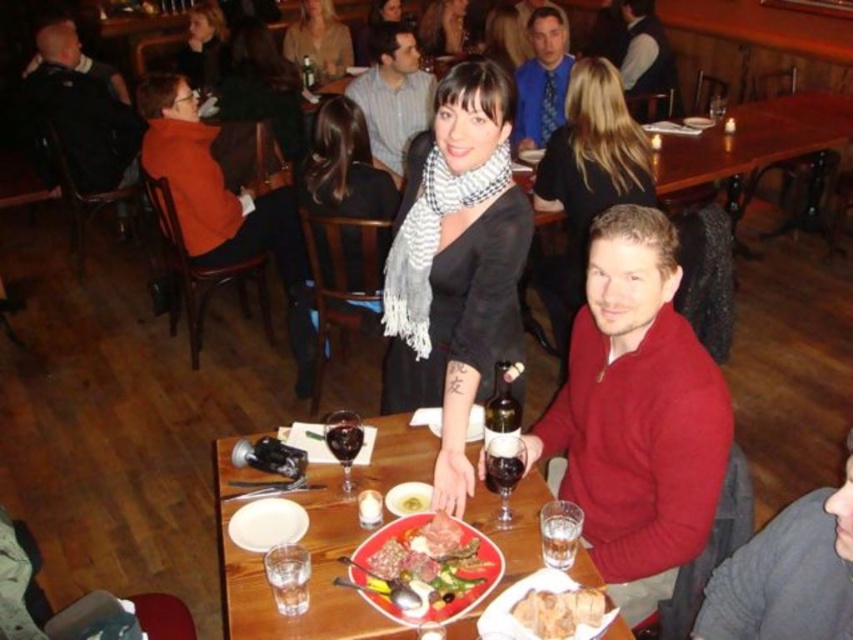
You are a fashion designer observing the blue silk tie at upper center and the velvet vest at upper center in the image. Which of these two items has a narrower width?

The blue silk tie at upper center has a narrower width than the velvet vest at upper center.

You are a server in a restaurant and need to place a new drink order on the table. The table has a smooth red plate at center. Where should you place the drink to avoid covering the plate?

The smooth red plate at center is located at point (430, 570). To avoid covering it, place the drink away from that coordinate.

You are a customer sitting at a table in this restaurant and want to place your black matte scarf at center on the table. Where exactly should you place it?

The black matte scarf at center should be placed at the coordinates point (459,266) on the table.